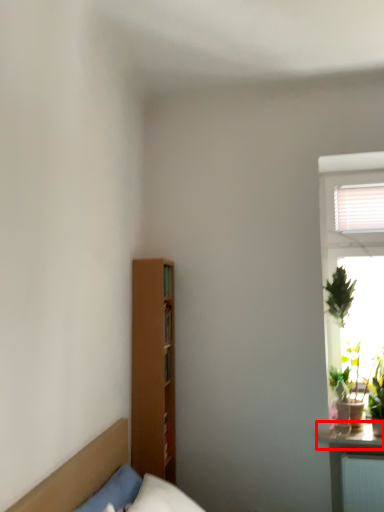
Question: Considering the relative positions of window sill (annotated by the red box) and furniture in the image provided, where is window sill (annotated by the red box) located with respect to the staircase?

Choices:
 (A) right
 (B) left

Answer: (A)